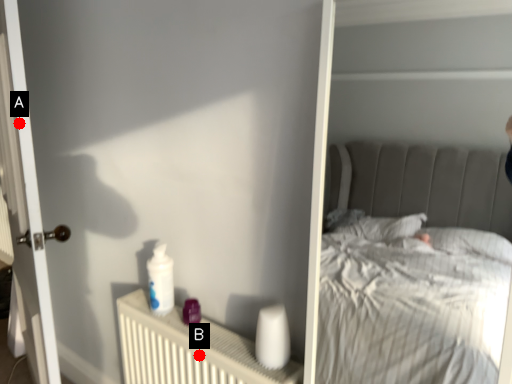
Question: Two points are circled on the image, labeled by A and B beside each circle. Which point is closer to the camera taking this photo?

Choices:
 (A) A is closer
 (B) B is closer

Answer: (B)